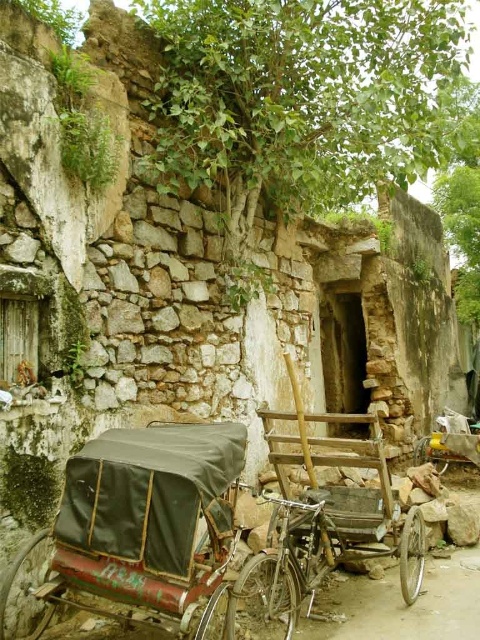
What do you see at coordinates (135, 524) in the screenshot? I see `rusty metal rickshaw at lower left` at bounding box center [135, 524].

Does rusty metal rickshaw at lower left have a greater width compared to rusty metal rickshaw at center?

No, rusty metal rickshaw at lower left is not wider than rusty metal rickshaw at center.

Where is `rusty metal rickshaw at lower left`? The height and width of the screenshot is (640, 480). rusty metal rickshaw at lower left is located at coordinates (135, 524).

The width and height of the screenshot is (480, 640). In order to click on rusty metal rickshaw at lower left in this screenshot , I will do `click(135, 524)`.